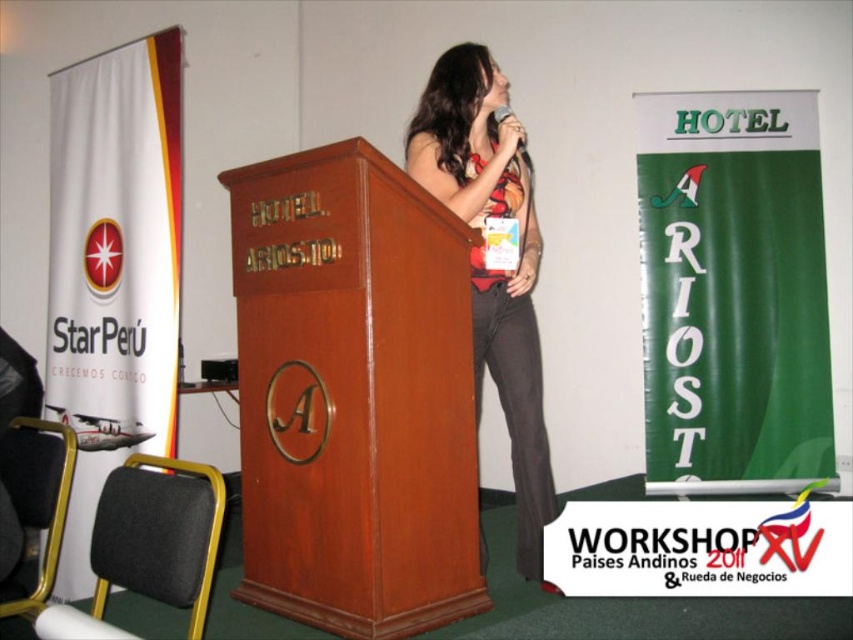
Between mahogany wood podium at center and metallic silver microphone at upper center, which one is positioned lower?

mahogany wood podium at center

Does mahogany wood podium at center come in front of metallic silver microphone at upper center?

Yes, mahogany wood podium at center is closer to the viewer.

Is point (264, 547) behind point (496, 116)?

No.

Identify the location of mahogany wood podium at center. This screenshot has width=853, height=640. (352, 396).

The width and height of the screenshot is (853, 640). Describe the element at coordinates (492, 269) in the screenshot. I see `matte black dress at center` at that location.

Is point (469, 83) positioned after point (503, 116)?

That is True.

Does point (428, 108) come closer to viewer compared to point (520, 141)?

No, (428, 108) is further to viewer.

The width and height of the screenshot is (853, 640). Identify the location of matte black dress at center. (492, 269).

Does mahogany wood podium at center have a lesser width compared to matte black dress at center?

Incorrect, mahogany wood podium at center's width is not less than matte black dress at center's.

Locate an element on the screen. mahogany wood podium at center is located at coordinates (352, 396).

Locate an element on the screen. The image size is (853, 640). mahogany wood podium at center is located at coordinates (352, 396).